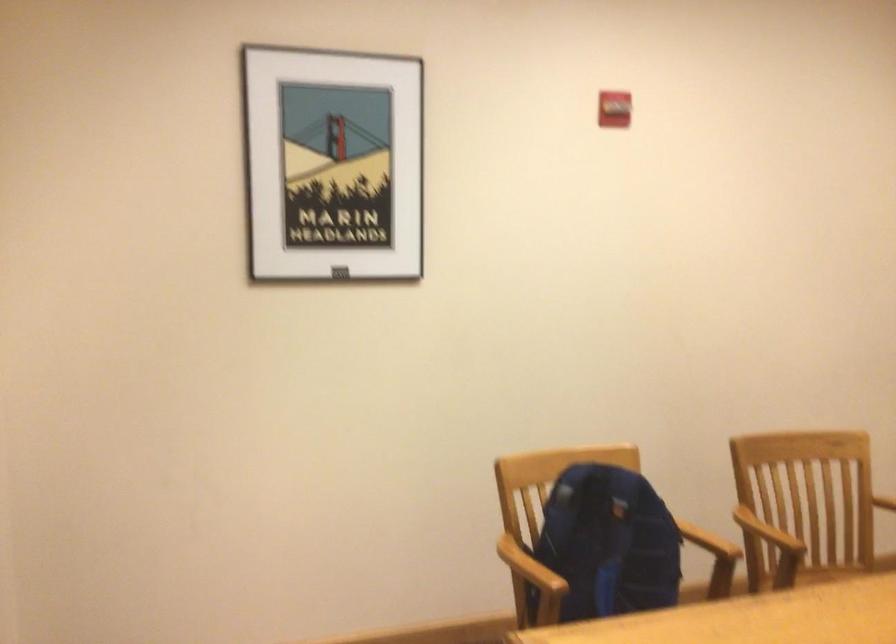
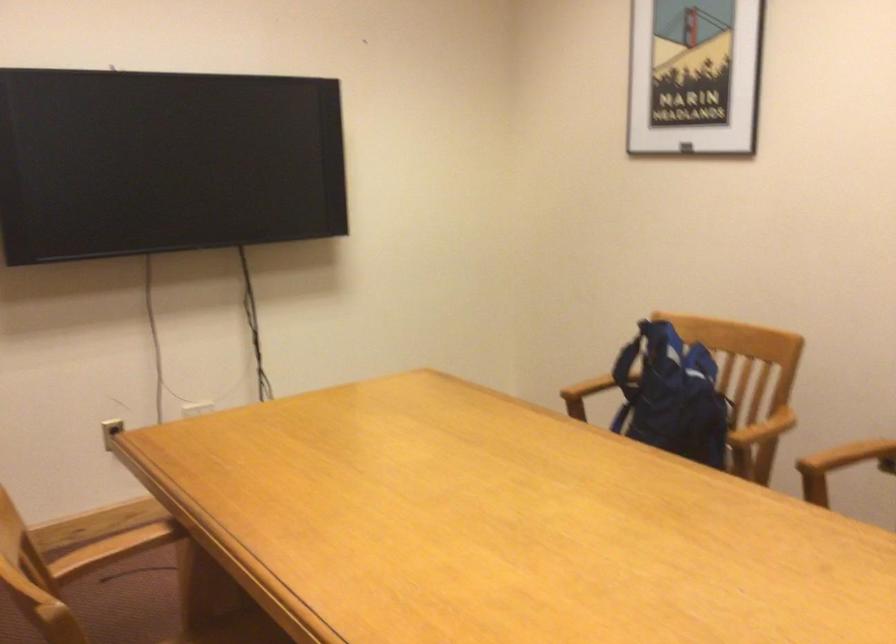
Locate, in the second image, the point that corresponds to [519,571] in the first image.

(586, 388)